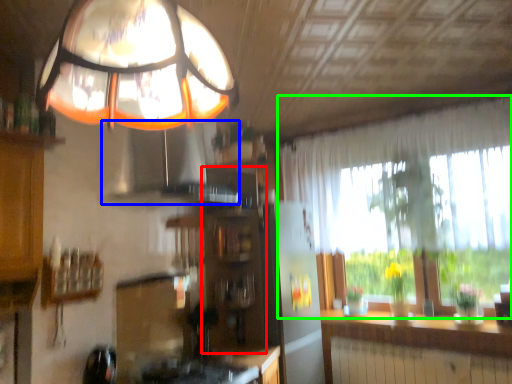
Question: Which is farther away from cabinetry (highlighted by a red box)? exhaust hood (highlighted by a blue box) or window (highlighted by a green box)?

Choices:
 (A) exhaust hood
 (B) window

Answer: (B)